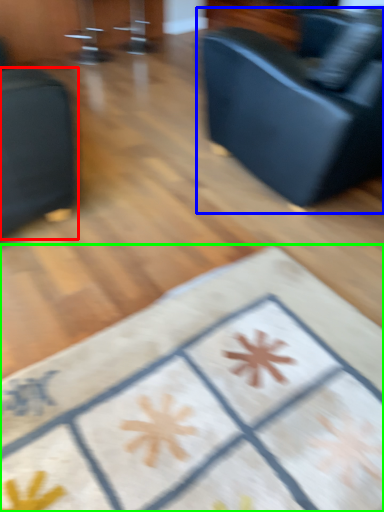
Question: Based on their relative distances, which object is nearer to furniture (highlighted by a red box)? Choose from studio couch (highlighted by a blue box) and furniture (highlighted by a green box).

Choices:
 (A) studio couch
 (B) furniture

Answer: (B)